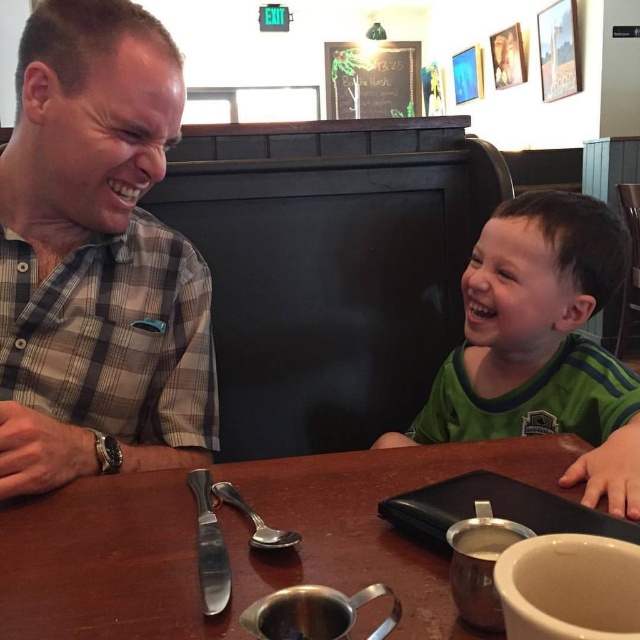
You are a guest at this table and need to place a napkin on the plaid shirt at left. However, you only have a napkin that fits items up to the size of the metallic silver creamer at center. Will the napkin be sufficient?

The plaid shirt at left has a larger size compared to the metallic silver creamer at center, so the napkin designed for the creamer will not be sufficient to cover the plaid shirt at left.

You are a waiter who needs to place a 10.17 inch long spoon on the table. Can you place the spoon so that it fits entirely on the brown wooden table at center without overlapping the metallic silver creamer at center?

The brown wooden table at center is 10.17 inches away from the metallic silver creamer at center. Since the spoon is exactly 10.17 inches long, it can be placed along the distance between them, ensuring it doesn not overlap the metallic silver creamer at center.

You are a photographer trying to capture a candid shot of the plaid shirt at left and the green jersey at right. Since you want both subjects to appear in the frame, which subject should you position closer to the camera to ensure both are fully visible?

The plaid shirt at left is thinner than the green jersey at right. To ensure both are fully visible in the frame, position the plaid shirt at left closer to the camera since it is narrower, allowing the wider green jersey at right to fit within the same shot without being cut off.